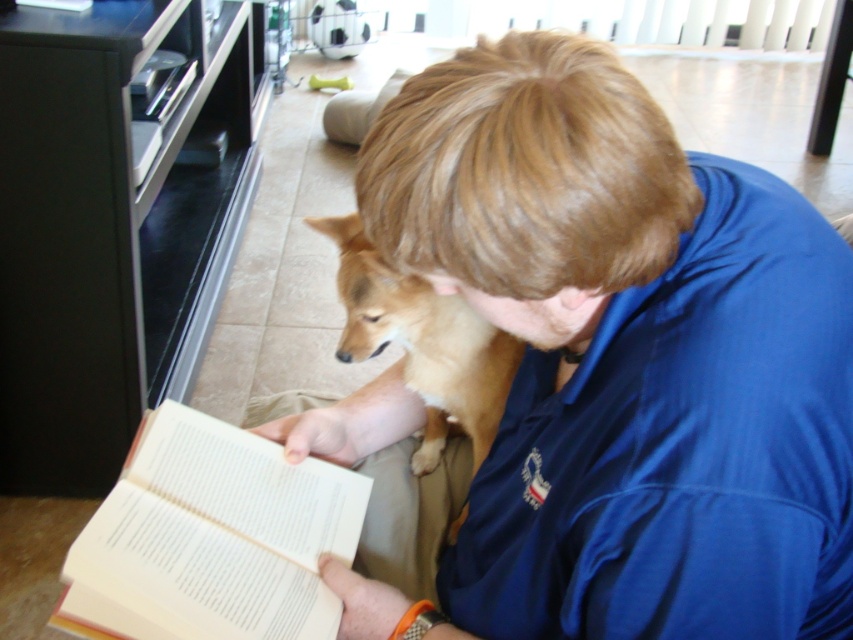
You are a tailor measuring fabric for a new project. You have a piece of fabric that is exactly the width of the light brown fur at center. Can you use this fabric to make a new shirt that fits the blue fabric shirt at center without any adjustments?

The blue fabric shirt at center has a larger width than the light brown fur at center. Since the fabric you have matches the width of the light brown fur at center, it is not wide enough to create a shirt with the same width as the blue fabric shirt at center. You would need a wider piece of fabric to make the shirt fit properly.

You are a photographer trying to capture a candid shot of the person reading and the dog. Since you want both subjects to be clearly visible, you need to ensure there is enough space between the white paper book at lower left and the light brown fur at center. Based on the scene, is there sufficient space between them?

The white paper book at lower left is positioned on the left side of light brown fur at center, so there is enough space between them to capture both subjects clearly.

The person and the white paper book at lower left are both in the same room. How far apart are they?

The person and the white paper book at lower left are 28.34 inches apart.